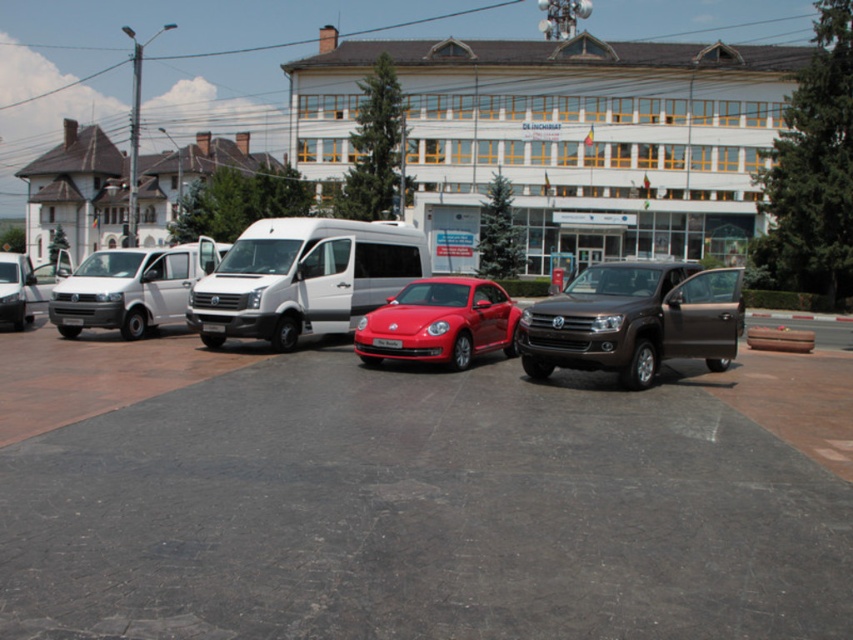
Question: Does white matte van at left appear under black plastic license plate at center?

Choices:
 (A) no
 (B) yes

Answer: (A)

Question: Which point is closer to the camera taking this photo?

Choices:
 (A) (379, 232)
 (B) (392, 342)

Answer: (B)

Question: Does satin brown suv at center appear under white plastic license plate at center?

Choices:
 (A) no
 (B) yes

Answer: (B)

Question: Which point is farther from the camera taking this photo?

Choices:
 (A) (389, 252)
 (B) (109, 259)

Answer: (A)

Question: Which object is the farthest from the shiny black car at center?

Choices:
 (A) satin brown suv at center
 (B) black plastic license plate at center
 (C) white matte van at center
 (D) white matte van at left

Answer: (D)

Question: Can you confirm if shiny black car at center is positioned to the left of black plastic license plate at center?

Choices:
 (A) yes
 (B) no

Answer: (B)